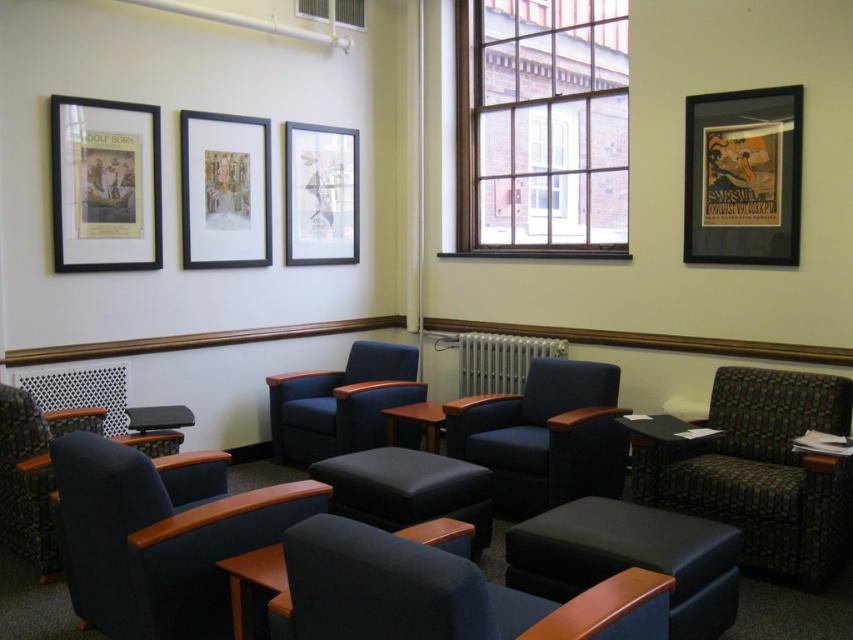
Question: Does matte blue armchair at center have a greater width compared to matte blue chair at lower left?

Choices:
 (A) no
 (B) yes

Answer: (B)

Question: Considering the relative positions of brown wooden window at center and black wood table at lower right in the image provided, where is brown wooden window at center located with respect to black wood table at lower right?

Choices:
 (A) left
 (B) right

Answer: (A)

Question: Considering the relative positions of blue fabric armchair at center and white metallic radiator at center in the image provided, where is blue fabric armchair at center located with respect to white metallic radiator at center?

Choices:
 (A) left
 (B) right

Answer: (A)

Question: Which point is closer to the camera?

Choices:
 (A) (148, 410)
 (B) (167, 454)

Answer: (B)

Question: Which point is farther to the camera?

Choices:
 (A) (808, 536)
 (B) (492, 84)
 (C) (592, 602)
 (D) (497, 483)

Answer: (B)

Question: Estimate the real-world distances between objects in this image. Which object is closer to the matte black picture frame at center?

Choices:
 (A) matte black stool at center
 (B) matte black poster at upper right

Answer: (A)